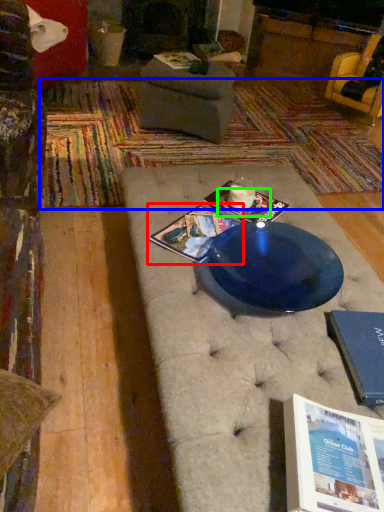
Question: Considering the real-world distances, which object is farthest from magazine (highlighted by a red box)? mat (highlighted by a blue box) or plate (highlighted by a green box)?

Choices:
 (A) mat
 (B) plate

Answer: (A)